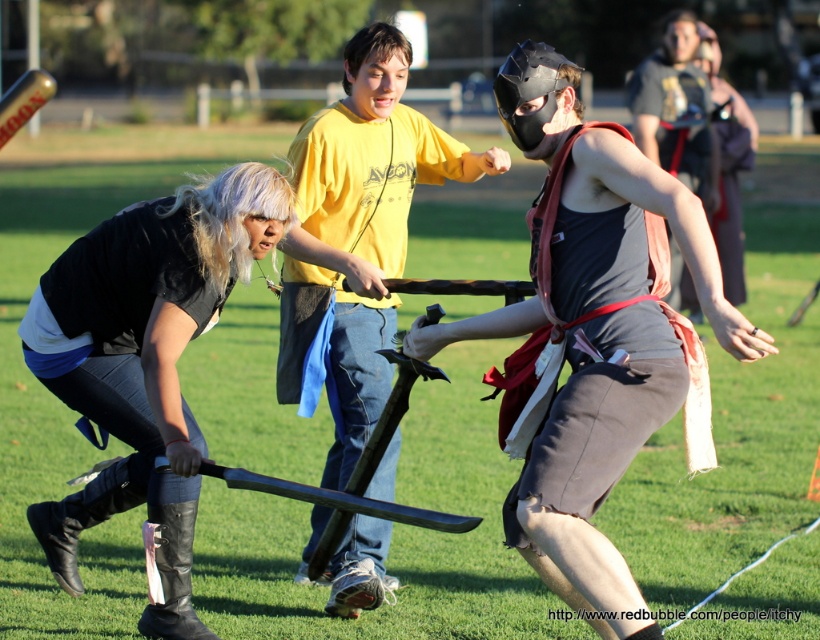
What do you see at coordinates (144, 364) in the screenshot? I see `black leather boots at lower left` at bounding box center [144, 364].

Can you confirm if black leather boots at lower left is thinner than yellow t-shirt at center?

No, black leather boots at lower left is not thinner than yellow t-shirt at center.

Who is more distant from viewer, (74, 577) or (295, 154)?

Point (295, 154)

The width and height of the screenshot is (820, 640). I want to click on black leather boots at lower left, so click(144, 364).

Is yellow t-shirt at center to the right of matte black helmet at center from the viewer's perspective?

No, yellow t-shirt at center is not to the right of matte black helmet at center.

How distant is yellow t-shirt at center from matte black helmet at center?

4.77 meters

Does point (285, 310) lie in front of point (697, 96)?

Yes, it is in front of point (697, 96).

Identify the location of yellow t-shirt at center. (358, 230).

Does point (604, 182) come in front of point (93, 296)?

Yes, point (604, 182) is in front of point (93, 296).

Measure the distance between matte black mask at center and black leather boots at lower left.

matte black mask at center is 1.34 meters from black leather boots at lower left.

Who is more distant from viewer, (x=540, y=484) or (x=153, y=316)?

The point (x=153, y=316) is behind.

Where is `matte black mask at center`? Image resolution: width=820 pixels, height=640 pixels. matte black mask at center is located at coordinates (590, 333).